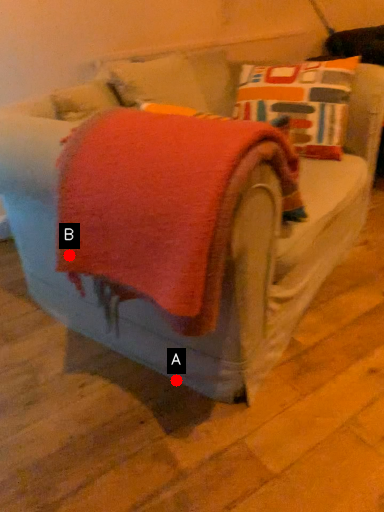
Question: Two points are circled on the image, labeled by A and B beside each circle. Which point is closer to the camera?

Choices:
 (A) A is closer
 (B) B is closer

Answer: (B)